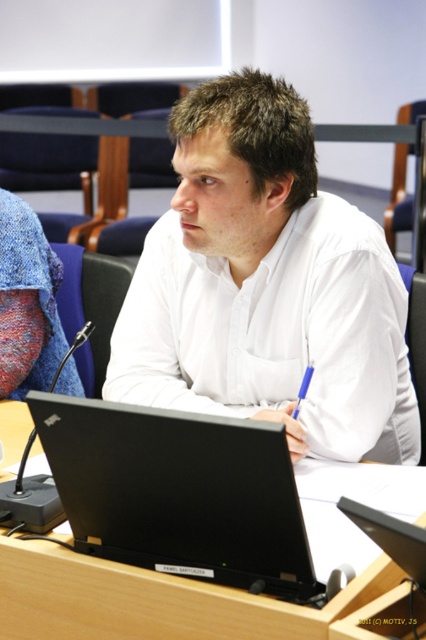
Which is behind, point (331, 282) or point (409, 572)?

The point (331, 282) is more distant.

I want to click on white smooth shirt at center, so click(265, 285).

Between point (143, 326) and point (181, 602), which one is positioned behind?

The point (143, 326) is more distant.

Does white smooth shirt at center come behind black plastic table at center?

Yes, white smooth shirt at center is further from the viewer.

Between point (270, 364) and point (241, 627), which one is positioned behind?

Positioned behind is point (270, 364).

At what (x,y) coordinates should I click in order to perform the action: click on white smooth shirt at center. Please return your answer as a coordinate pair (x, y). The image size is (426, 640). Looking at the image, I should click on (265, 285).

Between black plastic table at center and black matte laptop at center, which one is positioned lower?

black plastic table at center is lower down.

Does black plastic table at center appear over black matte laptop at center?

Incorrect, black plastic table at center is not positioned above black matte laptop at center.

Does point (54, 616) come closer to viewer compared to point (409, 570)?

No, it is behind (409, 570).

At what (x,y) coordinates should I click in order to perform the action: click on black plastic table at center. Please return your answer as a coordinate pair (x, y). The height and width of the screenshot is (640, 426). Looking at the image, I should click on (154, 600).